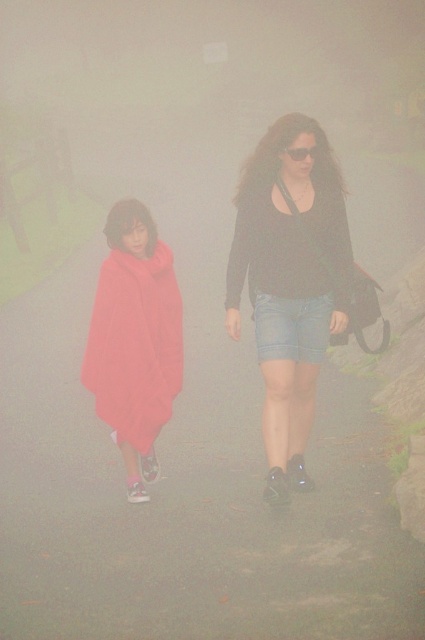
Question: Does denim shorts at center have a lesser width compared to matte red blanket at left?

Choices:
 (A) yes
 (B) no

Answer: (B)

Question: Does denim shorts at center come in front of matte red blanket at left?

Choices:
 (A) yes
 (B) no

Answer: (A)

Question: Is denim shorts at center to the right of matte red blanket at left from the viewer's perspective?

Choices:
 (A) yes
 (B) no

Answer: (A)

Question: Which of the following is the closest to the observer?

Choices:
 (A) matte red blanket at left
 (B) denim shorts at center

Answer: (B)